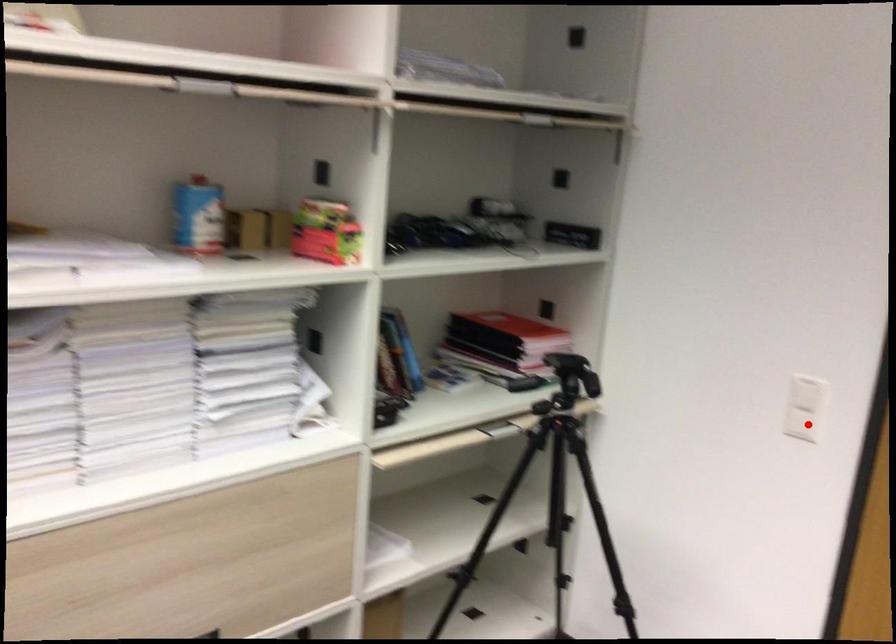
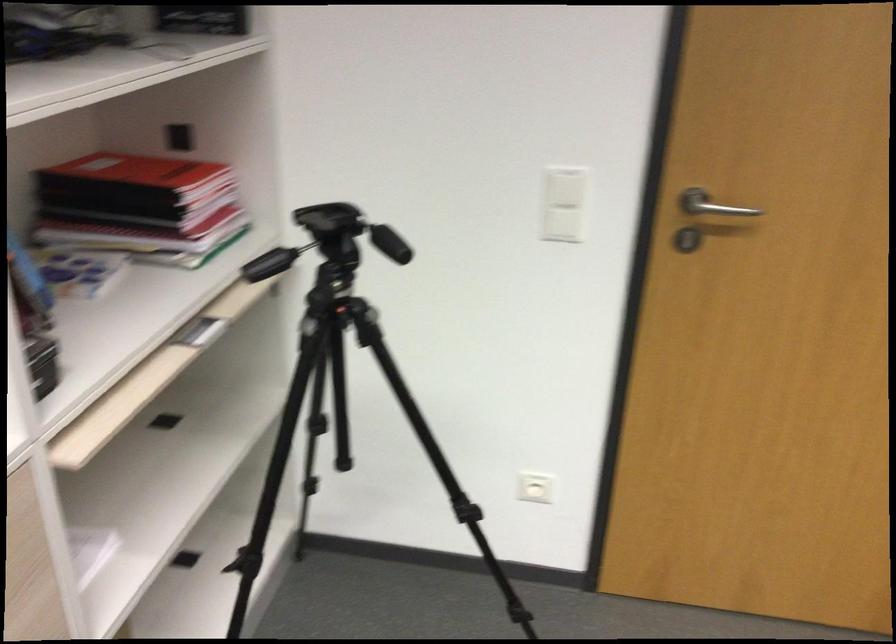
Question: I am providing you with two images of the same scene from different viewpoints. Given a red point in image1, look at the same physical point in image2. Is it:

Choices:
 (A) Closer to the viewpoint
 (B) Farther from the viewpoint

Answer: (A)